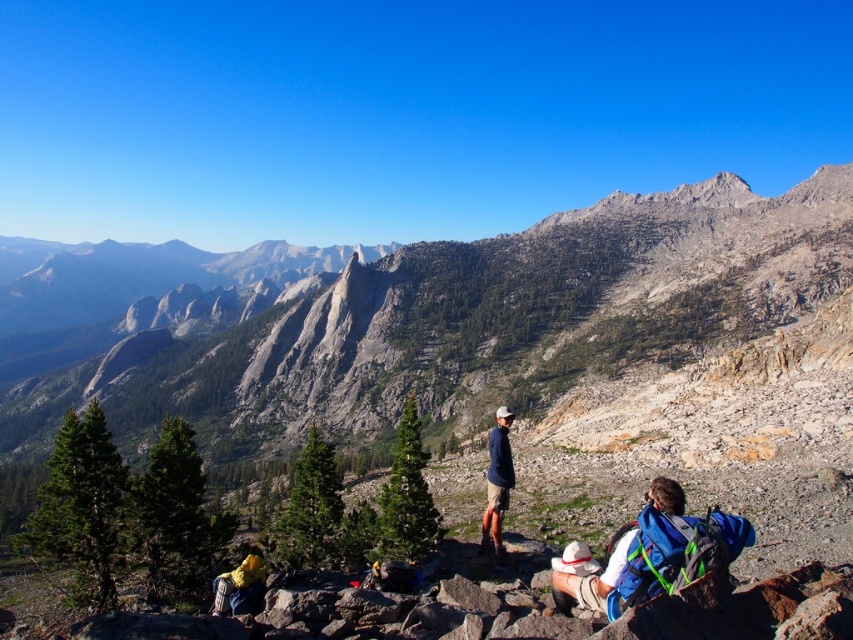
Consider the image. Does gray rocky mountain at center appear on the left side of yellow fabric backpack at lower left?

Correct, you'll find gray rocky mountain at center to the left of yellow fabric backpack at lower left.

Which is more to the left, gray rocky mountain at center or yellow fabric backpack at lower left?

Positioned to the left is gray rocky mountain at center.

Describe the element at coordinates (456, 321) in the screenshot. I see `gray rocky mountain at center` at that location.

Where is `gray rocky mountain at center`? This screenshot has width=853, height=640. gray rocky mountain at center is located at coordinates (456, 321).